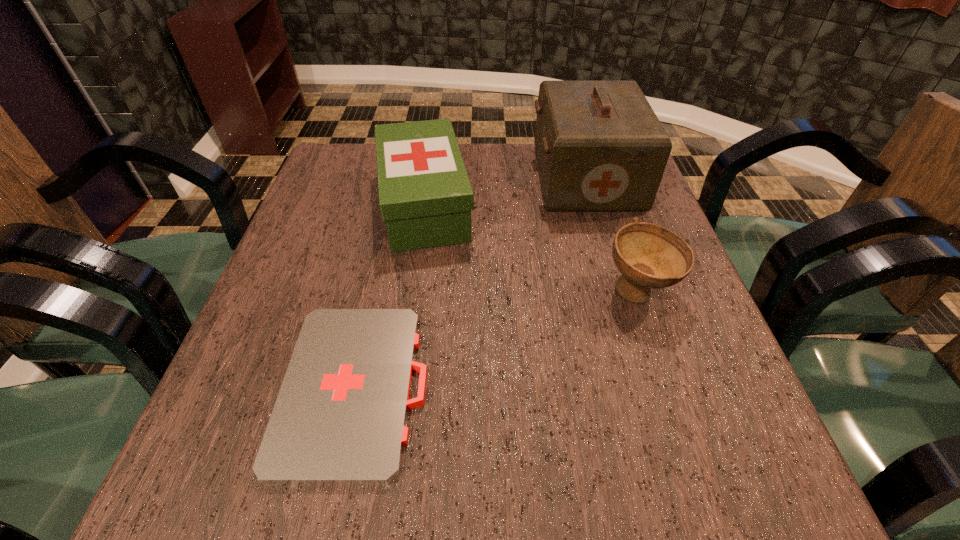
At what (x,y) coordinates should I click in order to perform the action: click on the tallest first-aid kit. Please return your answer as a coordinate pair (x, y). This screenshot has width=960, height=540. Looking at the image, I should click on (600, 146).

Where is `the tallest object`? The width and height of the screenshot is (960, 540). the tallest object is located at coordinates (600, 146).

The image size is (960, 540). Identify the location of the second shortest first-aid kit. (425, 197).

The height and width of the screenshot is (540, 960). What are the coordinates of `soup bowl` in the screenshot? It's located at (648, 256).

Locate an element on the screen. the shortest object is located at coordinates (340, 416).

You are a GUI agent. You are given a task and a screenshot of the screen. Output one action in this format:
    pyautogui.click(x=<x>, y=<y>)
    Task: Click on the shortest first-aid kit
    The image size is (960, 540).
    Given the screenshot: What is the action you would take?
    pyautogui.click(x=340, y=416)

I want to click on free location located 0.190m on the front of the tallest object, so click(x=612, y=269).

Where is `vacant space situated 0.110m on the back of the second shortest first-aid kit`? The image size is (960, 540). vacant space situated 0.110m on the back of the second shortest first-aid kit is located at coordinates (433, 144).

The image size is (960, 540). I want to click on free space located 0.140m on the left of the soup bowl, so click(x=533, y=292).

Find the location of a particular element. Image resolution: width=960 pixels, height=540 pixels. vacant space located on handle side the nearest first-aid kit is located at coordinates (647, 388).